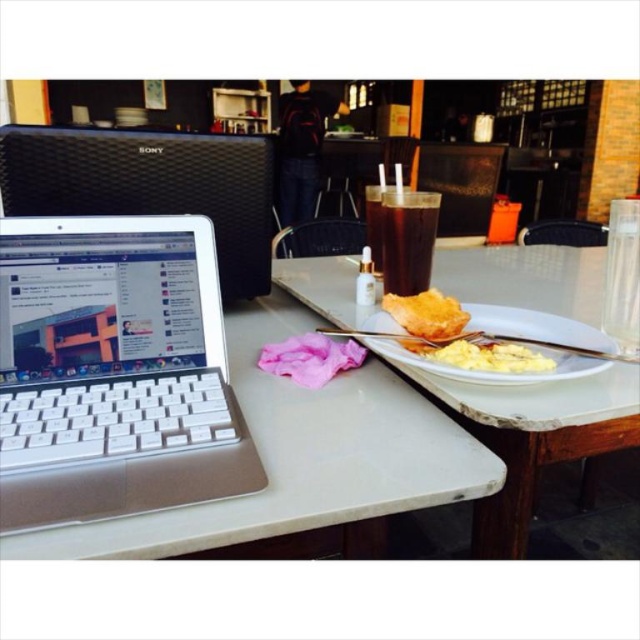
Question: Can you confirm if white plastic table at lower left is bigger than white matte plate at center?

Choices:
 (A) yes
 (B) no

Answer: (A)

Question: Which object appears farthest from the camera in this image?

Choices:
 (A) white marble plate at center
 (B) white matte plate at center

Answer: (B)

Question: Which is nearer to the white matte plate at center?

Choices:
 (A) white fluffy scrambled eggs at right
 (B) white plastic table at lower left

Answer: (A)

Question: Can you confirm if white plastic table at lower left is thinner than dark brown glass at center?

Choices:
 (A) no
 (B) yes

Answer: (A)

Question: Considering the relative positions of white fluffy scrambled eggs at right and golden crispy bread at center in the image provided, where is white fluffy scrambled eggs at right located with respect to golden crispy bread at center?

Choices:
 (A) below
 (B) above

Answer: (A)

Question: Which is nearer to the white matte plate at center?

Choices:
 (A) white plastic laptop at left
 (B) white fluffy scrambled eggs at right

Answer: (B)